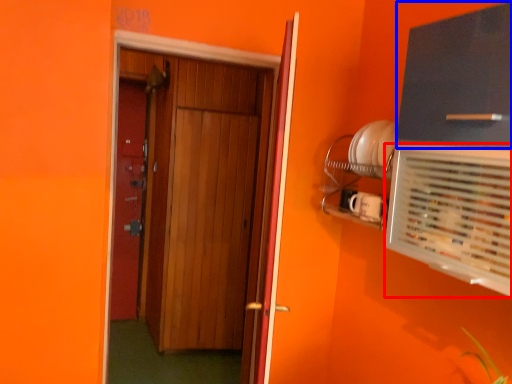
Question: Which object is closer to the camera taking this photo, air conditioning (highlighted by a red box) or cabinetry (highlighted by a blue box)?

Choices:
 (A) air conditioning
 (B) cabinetry

Answer: (A)